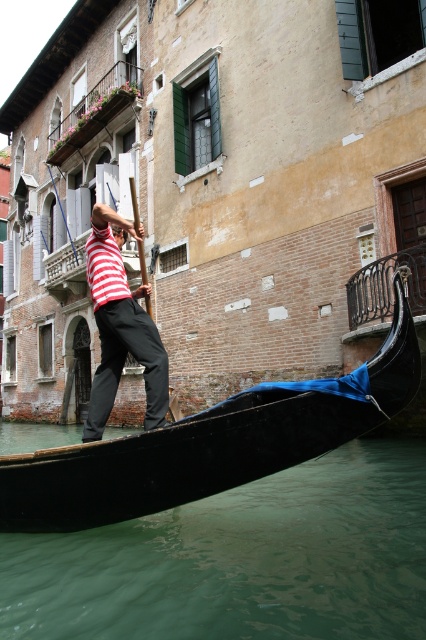
You are a tourist standing on the canal bridge and want to take a photo of the black polished gondola at center and the striped fabric shirt at center. Which object is closer to the water surface?

The black polished gondola at center is closer to the water surface since it has a lesser height compared to the striped fabric shirt at center.

You are a tourist standing on the canal bridge and want to take a photo of the black polished gondola at center. However, you notice the green translucent water at lower center is blocking your view. Can you move to the left or right to avoid the water?

The green translucent water at lower center is positioned under the black polished gondola at center, so moving to either the left or right side of the gondola would allow you to avoid the water and get a clear view of the black polished gondola at center.

You are a tourist standing on the canal bridge and want to take a photo of the black polished gondola at center and the green translucent water at lower center. Can you fit both objects in your camera frame if your camera has a maximum field of view of 1.5 meters width?

The green translucent water at lower center and black polished gondola at center are 1.38 meters apart from each other, so yes, the camera can capture both objects within its 1.5 meters field of view since the distance between them is less than the maximum width.